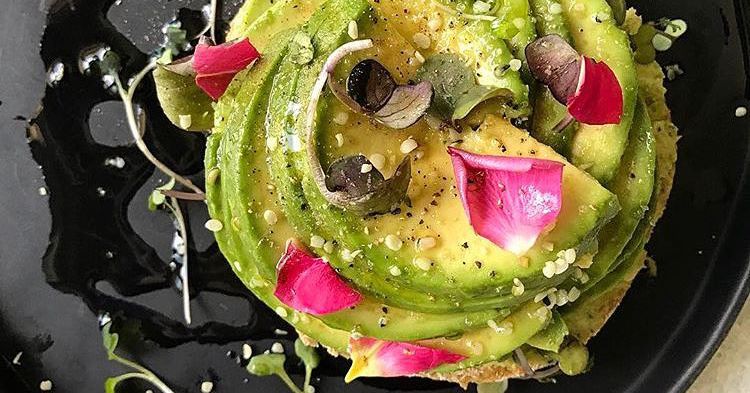
The width and height of the screenshot is (750, 393). In order to click on tabletop in this screenshot , I will do (736, 361).